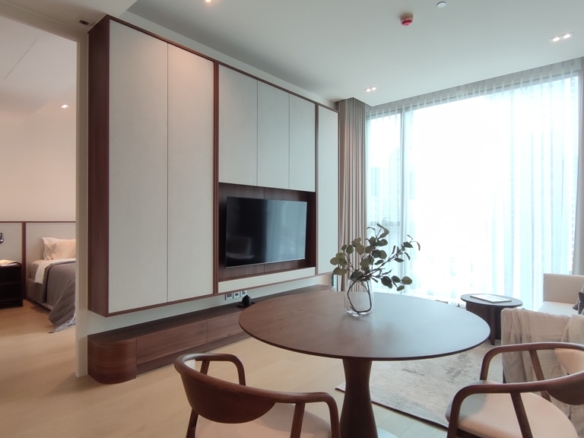
I want to click on plant, so click(x=366, y=272).